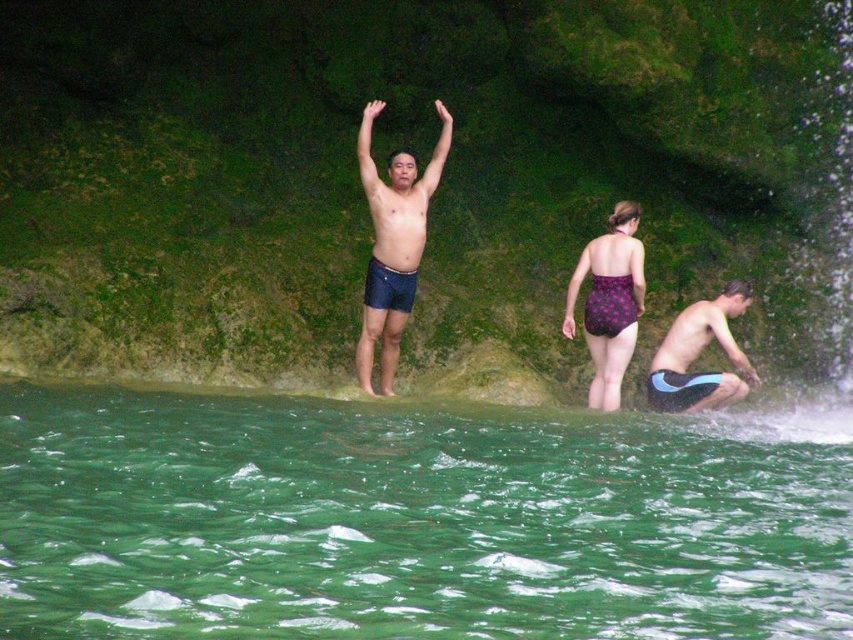
Between dark blue shorts at center and blue and white swim trunks at lower right, which one has less height?

blue and white swim trunks at lower right is shorter.

This screenshot has width=853, height=640. Describe the element at coordinates (393, 243) in the screenshot. I see `dark blue shorts at center` at that location.

Where is `dark blue shorts at center`? dark blue shorts at center is located at coordinates (393, 243).

Does green translucent water at lower center come in front of blue and white swim trunks at lower right?

Yes, green translucent water at lower center is closer to the viewer.

Between green translucent water at lower center and blue and white swim trunks at lower right, which one has less height?

With less height is green translucent water at lower center.

Which is in front, point (254, 472) or point (738, 369)?

Point (254, 472) is in front.

Image resolution: width=853 pixels, height=640 pixels. In order to click on green translucent water at lower center in this screenshot , I will do `click(415, 518)`.

What do you see at coordinates (399, 195) in the screenshot? This screenshot has height=640, width=853. I see `dark blue swim trunks at center` at bounding box center [399, 195].

Is point (670, 346) positioned in front of point (393, 353)?

Yes, it is in front of point (393, 353).

You are a GUI agent. You are given a task and a screenshot of the screen. Output one action in this format:
    pyautogui.click(x=<x>, y=<y>)
    Task: Click on the dark blue swim trunks at center
    Image resolution: width=853 pixels, height=640 pixels.
    Given the screenshot: What is the action you would take?
    pyautogui.click(x=399, y=195)